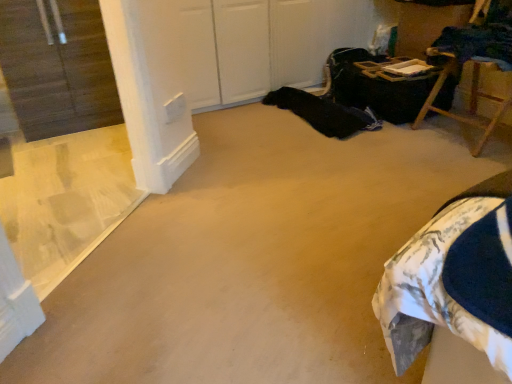
This screenshot has width=512, height=384. I want to click on vacant area that lies to the right of transparent plastic window at left, so click(256, 255).